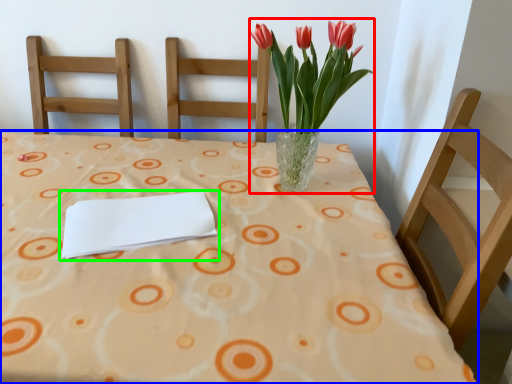
Question: Which is farther away from floral arrangement (highlighted by a red box)? table (highlighted by a blue box) or journal (highlighted by a green box)?

Choices:
 (A) table
 (B) journal

Answer: (B)